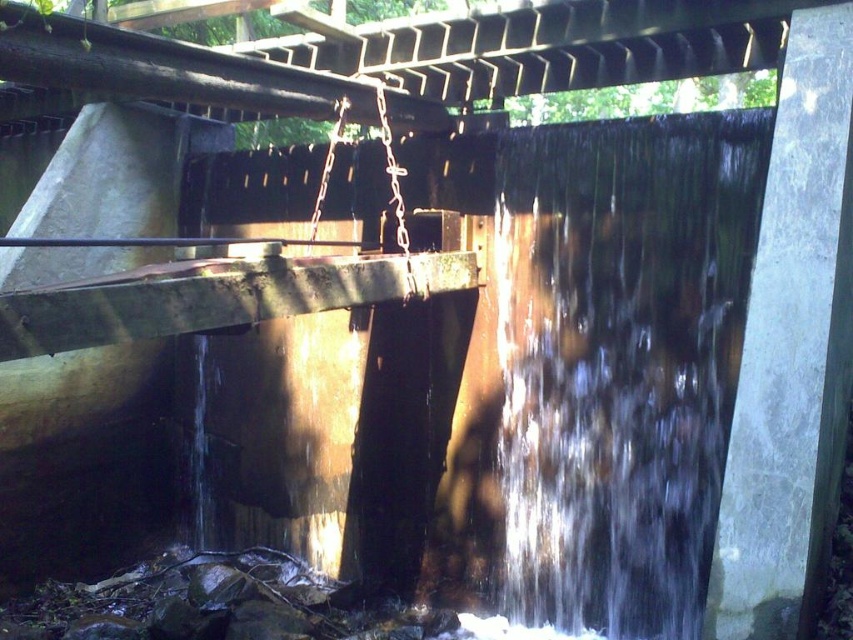
You are a maintenance worker assessing the sluice gate system. You observe the clear water at center and the rusty metal beam at center. Which object is positioned higher in the structure?

The clear water at center is much taller than the rusty metal beam at center, so the clear water at center is positioned higher in the structure.